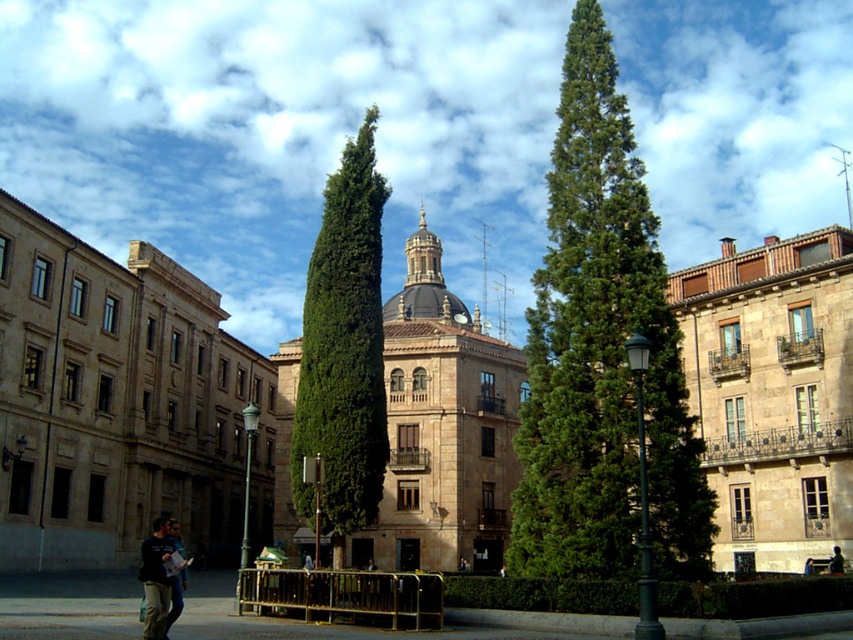
Question: Based on their relative distances, which object is farther from the green leafy tree at center?

Choices:
 (A) dark gray fabric jacket at lower left
 (B) silhouette figure at center
 (C) green coniferous tree at center

Answer: (B)

Question: Among these objects, which one is farthest from the camera?

Choices:
 (A) dark blue jeans at lower left
 (B) dark gray fabric jacket at lower left
 (C) green leafy tree at center

Answer: (C)

Question: Is dark gray fabric jacket at lower left smaller than dark blue jeans at lower left?

Choices:
 (A) no
 (B) yes

Answer: (A)

Question: Is green coniferous tree at center above green leafy tree at center?

Choices:
 (A) yes
 (B) no

Answer: (B)

Question: Does green coniferous tree at center have a smaller size compared to silhouette figure at center?

Choices:
 (A) yes
 (B) no

Answer: (B)

Question: Which point is closer to the camera?

Choices:
 (A) green coniferous tree at center
 (B) dark blue jeans at lower left

Answer: (B)